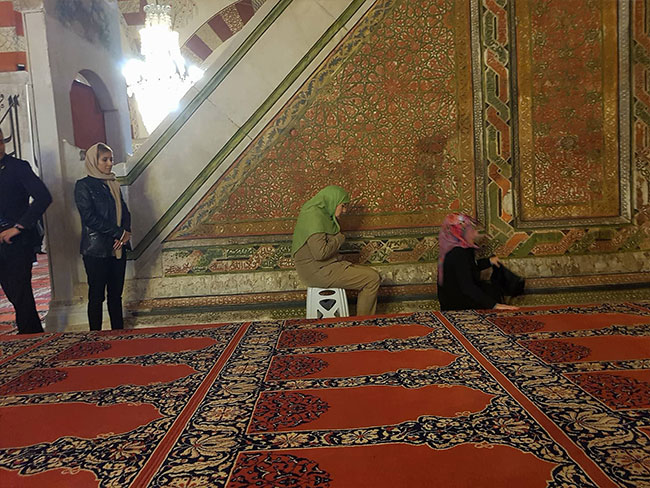
Locate an element on the screen. designed rug is located at coordinates (121, 375).